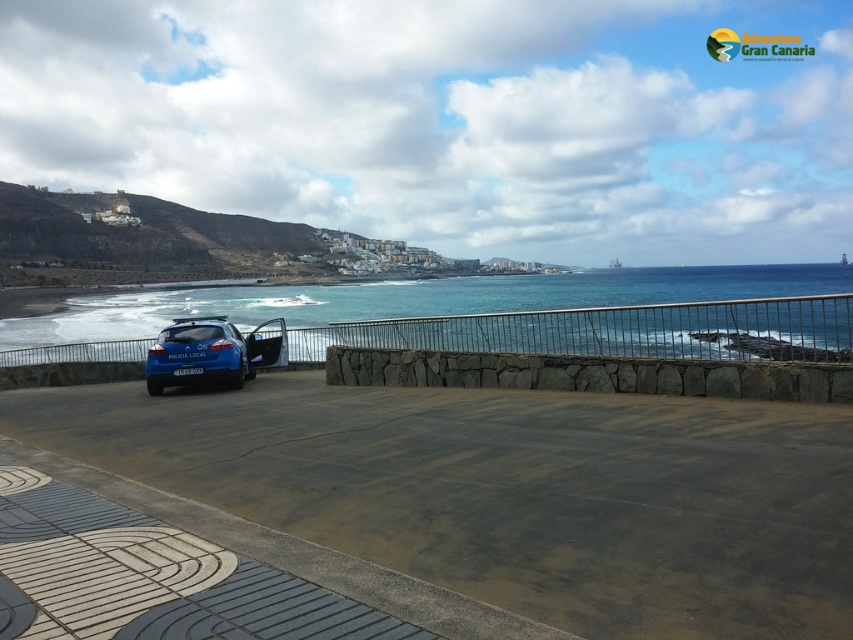
Question: Does blue water at center have a greater width compared to blue matte police car at center?

Choices:
 (A) no
 (B) yes

Answer: (B)

Question: Which object is closer to the camera taking this photo?

Choices:
 (A) blue water at center
 (B) blue matte police car at center

Answer: (A)

Question: Can you confirm if blue water at center is wider than blue matte police car at center?

Choices:
 (A) yes
 (B) no

Answer: (A)

Question: Which point is farther from the camera taking this photo?

Choices:
 (A) (761, 314)
 (B) (158, 342)

Answer: (B)

Question: Is blue water at center to the right of blue matte police car at center from the viewer's perspective?

Choices:
 (A) yes
 (B) no

Answer: (A)